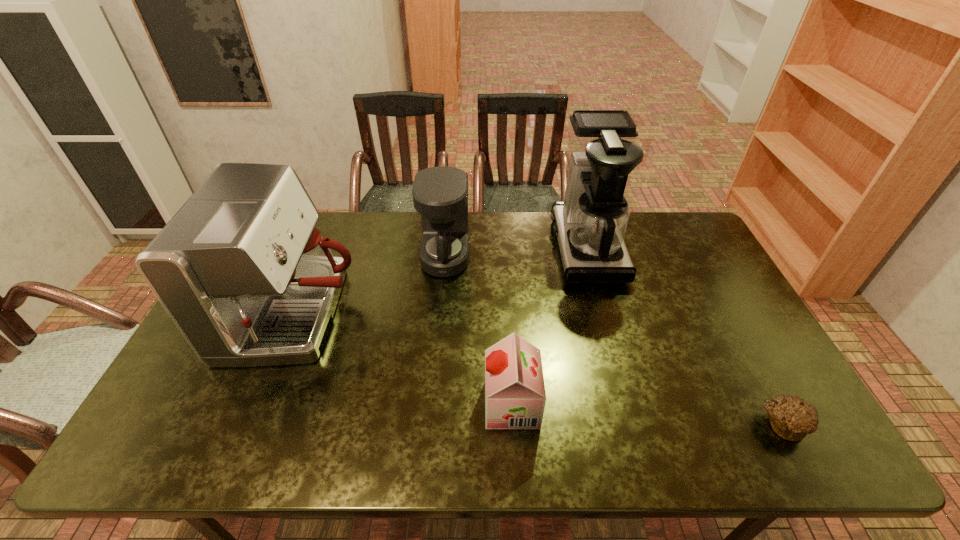
In order to click on the fourth object from left to right in this screenshot , I will do `click(590, 224)`.

The width and height of the screenshot is (960, 540). I want to click on the leftmost coffee maker, so click(x=248, y=280).

Locate an element on the screen. The image size is (960, 540). the fourth object from right to left is located at coordinates (440, 194).

What are the coordinates of `the shortest coffee maker` in the screenshot? It's located at (440, 194).

You are a GUI agent. You are given a task and a screenshot of the screen. Output one action in this format:
    pyautogui.click(x=<x>, y=<y>)
    Task: Click on the soya milk
    
    Given the screenshot: What is the action you would take?
    pyautogui.click(x=515, y=397)

Locate an element on the screen. The width and height of the screenshot is (960, 540). the fourth tallest object is located at coordinates (515, 397).

Identify the location of the shortest object. The height and width of the screenshot is (540, 960). (792, 418).

You are a GUI agent. You are given a task and a screenshot of the screen. Output one action in this format:
    pyautogui.click(x=<x>, y=<y>)
    Task: Click on the rightmost object
    Image resolution: width=960 pixels, height=540 pixels.
    Given the screenshot: What is the action you would take?
    pyautogui.click(x=792, y=418)

This screenshot has width=960, height=540. In order to click on vacant point located 0.190m at the front of the fourth object from left to right where the controls are located in this screenshot , I will do `click(499, 247)`.

This screenshot has width=960, height=540. I want to click on vacant region located 0.260m at the front of the fourth object from left to right where the controls are located, so click(x=478, y=247).